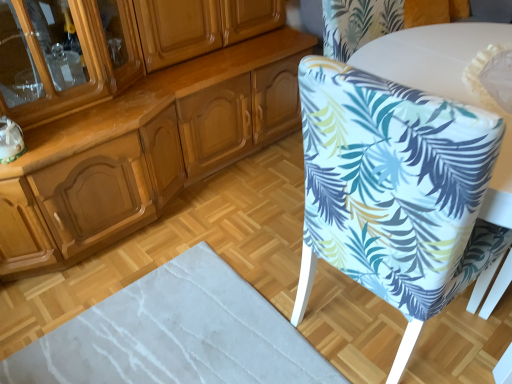
Question: Is white glossy round table at upper right to the left or to the right of transparent glass cabinet at upper left in the image?

Choices:
 (A) right
 (B) left

Answer: (A)

Question: From a real-world perspective, is white glossy round table at upper right physically located above or below transparent glass cabinet at upper left?

Choices:
 (A) above
 (B) below

Answer: (B)

Question: Which is farther from the white glossy round table at upper right?

Choices:
 (A) white fabric-covered chair at right
 (B) transparent glass cabinet at upper left

Answer: (B)

Question: Estimate the real-world distances between objects in this image. Which object is closer to the white fabric-covered chair at right?

Choices:
 (A) transparent glass cabinet at upper left
 (B) white glossy round table at upper right

Answer: (B)